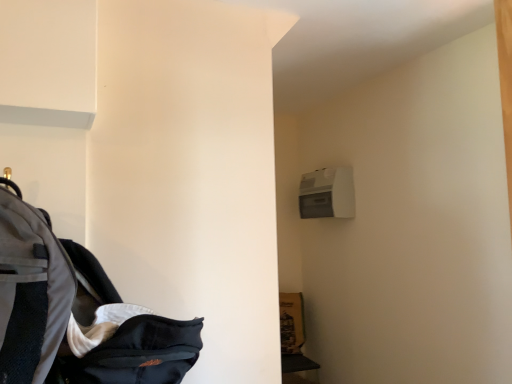
The height and width of the screenshot is (384, 512). What do you see at coordinates (327, 193) in the screenshot? I see `white plastic thermostat at upper right` at bounding box center [327, 193].

Measure the distance between point [304,199] and camera.

Point [304,199] and camera are 6.60 feet apart from each other.

Image resolution: width=512 pixels, height=384 pixels. Find the location of `white plastic thermostat at upper right`. white plastic thermostat at upper right is located at coordinates (327, 193).

The height and width of the screenshot is (384, 512). I want to click on white plastic thermostat at upper right, so click(x=327, y=193).